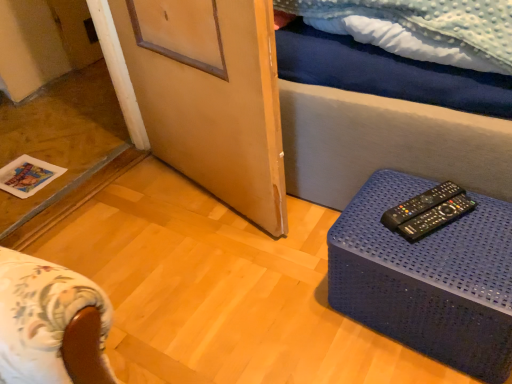
Find the location of a particular element. Image resolution: width=512 pixels, height=384 pixels. free space in front of black plastic remote control at right, positioned as the 1th remote control in back-to-front order is located at coordinates (452, 255).